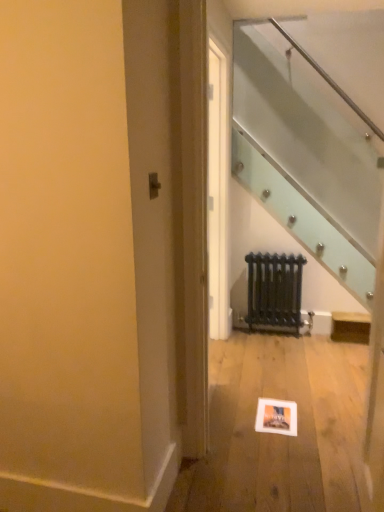
Where is `vacant point to the left of black metal radiator at center`? The height and width of the screenshot is (512, 384). vacant point to the left of black metal radiator at center is located at coordinates (241, 335).